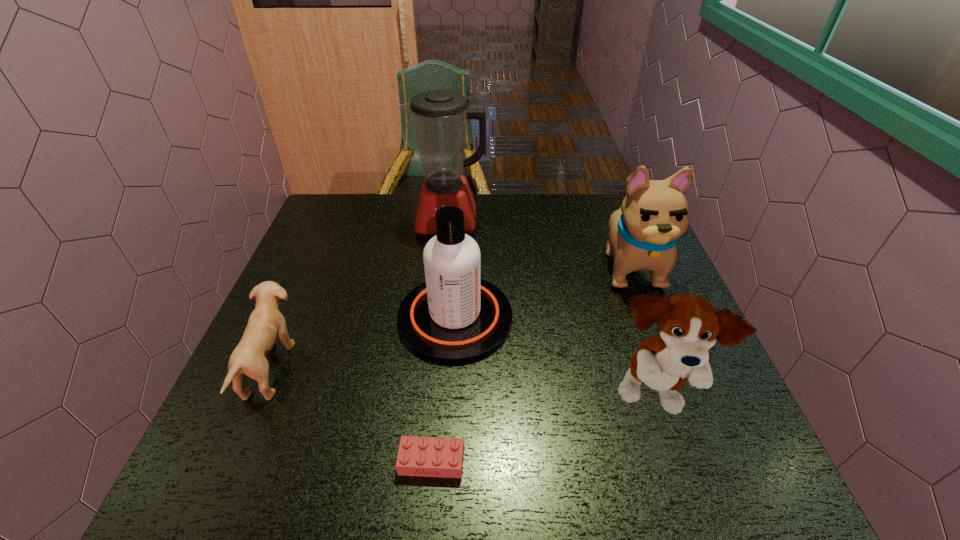
At what (x,y) coordinates should I click in order to perform the action: click on puppy object that ranks as the closest to the leftmost object. Please return your answer as a coordinate pair (x, y). The width and height of the screenshot is (960, 540). Looking at the image, I should click on (x=689, y=325).

The width and height of the screenshot is (960, 540). I want to click on vacant space that satisfies the following two spatial constraints: 1. on the back side of the Lego; 2. on the left side of the leftmost puppy, so click(x=440, y=368).

At what (x,y) coordinates should I click in order to perform the action: click on free location that satisfies the following two spatial constraints: 1. on the back side of the cleansing agent; 2. on the left side of the nearest object. Please return your answer as a coordinate pair (x, y). The height and width of the screenshot is (540, 960). Looking at the image, I should click on (444, 318).

Locate an element on the screen. free location that satisfies the following two spatial constraints: 1. on the front of the shortest object near the controls; 2. on the left side of the blender is located at coordinates (425, 461).